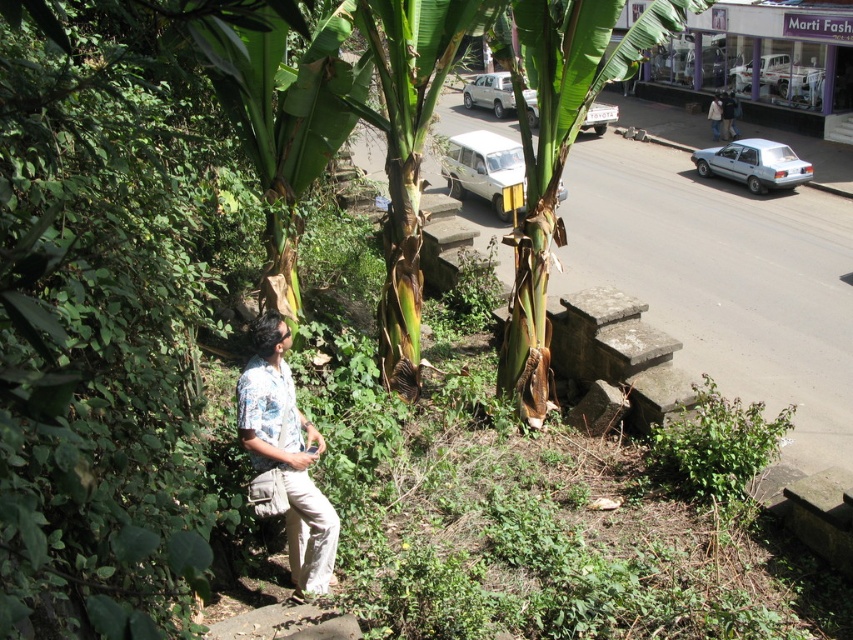
Between green leafy banana tree at center and floral shirt at lower left, which one has less height?

Standing shorter between the two is floral shirt at lower left.

Measure the distance from green leafy banana tree at center to floral shirt at lower left.

The distance of green leafy banana tree at center from floral shirt at lower left is 3.41 meters.

Between point (596, 10) and point (267, 310), which one is positioned behind?

The point (267, 310) is behind.

This screenshot has width=853, height=640. I want to click on green leafy banana tree at center, so click(x=556, y=148).